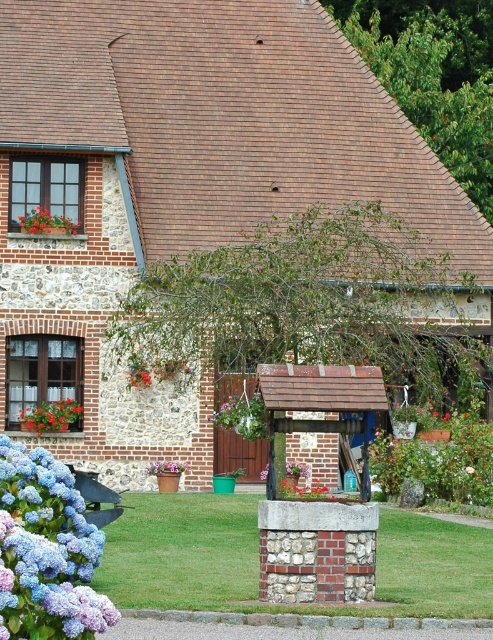
At what (x,y) coordinates should I click in order to perform the action: click on green grass at center. Please return your answer as a coordinate pair (x, y). Looking at the image, I should click on (257, 563).

Describe the element at coordinates (45, 221) in the screenshot. Image resolution: width=493 pixels, height=640 pixels. I see `matte red flowers at upper left` at that location.

Can you confirm if matte red flowers at upper left is positioned to the right of pink fabric flower at lower center?

Incorrect, matte red flowers at upper left is not on the right side of pink fabric flower at lower center.

Between point (24, 232) and point (178, 464), which one is positioned behind?

The point (178, 464) is more distant.

I want to click on matte red flowers at upper left, so click(45, 221).

Is point (408, 609) farther from camera compared to point (64, 230)?

No, (408, 609) is closer to viewer.

Does point (247, 538) come farther from viewer compared to point (75, 227)?

No, (247, 538) is closer to viewer.

Locate an element on the screen. Image resolution: width=493 pixels, height=640 pixels. green grass at center is located at coordinates (257, 563).